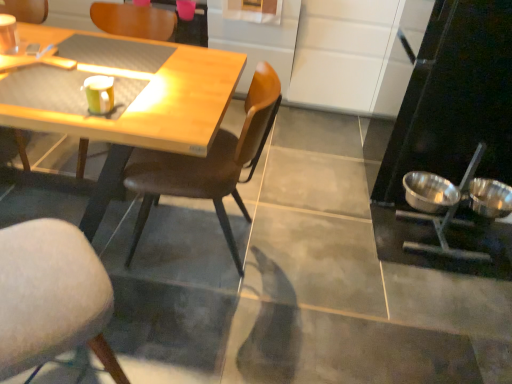
Question: From a real-world perspective, is soft gray cushioned chair at lower left, which is the third chair in left-to-right order, positioned over brown leather chair at center, which is counted as the fourth chair, starting from the left, based on gravity?

Choices:
 (A) yes
 (B) no

Answer: (B)

Question: From a real-world perspective, is soft gray cushioned chair at lower left, which is the third chair in left-to-right order, located beneath brown leather chair at center, which is counted as the fourth chair, starting from the left?

Choices:
 (A) yes
 (B) no

Answer: (A)

Question: Considering the relative sizes of soft gray cushioned chair at lower left, which is the third chair in left-to-right order, and brown leather chair at center, which is counted as the fourth chair, starting from the left, in the image provided, is soft gray cushioned chair at lower left, which is the third chair in left-to-right order, shorter than brown leather chair at center, which is counted as the fourth chair, starting from the left,?

Choices:
 (A) no
 (B) yes

Answer: (B)

Question: Is brown leather chair at center, which is counted as the fourth chair, starting from the left, located within soft gray cushioned chair at lower left, the 2th chair in the right-to-left sequence?

Choices:
 (A) yes
 (B) no

Answer: (B)

Question: Is soft gray cushioned chair at lower left, the 2th chair in the right-to-left sequence, closer to camera compared to brown leather chair at center, positioned as the 1th chair in right-to-left order?

Choices:
 (A) no
 (B) yes

Answer: (B)

Question: Based on their positions, is shiny metallic bowl at right, which is counted as the 1th bowl, starting from the right, located to the left or right of stainless steel bowls at right?

Choices:
 (A) left
 (B) right

Answer: (B)

Question: Which is correct: shiny metallic bowl at right, the second bowl positioned from the left, is inside stainless steel bowls at right, or outside of it?

Choices:
 (A) inside
 (B) outside

Answer: (B)

Question: From their relative heights in the image, would you say shiny metallic bowl at right, the second bowl positioned from the left, is taller or shorter than stainless steel bowls at right?

Choices:
 (A) tall
 (B) short

Answer: (B)

Question: From the image's perspective, is shiny metallic bowl at right, which is counted as the 1th bowl, starting from the right, located above or below stainless steel bowls at right?

Choices:
 (A) below
 (B) above

Answer: (A)

Question: From a real-world perspective, relative to soft gray cushioned chair at lower left, the 2th chair in the right-to-left sequence, is wooden chair at center, the 3th chair in the right-to-left sequence, vertically above or below?

Choices:
 (A) above
 (B) below

Answer: (A)

Question: In terms of height, does wooden chair at center, the 3th chair in the right-to-left sequence, look taller or shorter compared to soft gray cushioned chair at lower left, the 2th chair in the right-to-left sequence?

Choices:
 (A) short
 (B) tall

Answer: (B)

Question: In terms of width, does wooden chair at center, the 3th chair in the right-to-left sequence, look wider or thinner when compared to soft gray cushioned chair at lower left, the 2th chair in the right-to-left sequence?

Choices:
 (A) wide
 (B) thin

Answer: (A)

Question: Is wooden chair at center, arranged as the 2th chair when viewed from the left, situated inside soft gray cushioned chair at lower left, the 2th chair in the right-to-left sequence, or outside?

Choices:
 (A) inside
 (B) outside

Answer: (B)

Question: From a real-world perspective, is pink matte coffee cup at upper center, arranged as the first coffee cup when viewed from the top, above or below matte yellow cup at upper left, the second coffee cup positioned from the back?

Choices:
 (A) above
 (B) below

Answer: (B)

Question: Is pink matte coffee cup at upper center, the first coffee cup viewed from the back, situated inside matte yellow cup at upper left, the second coffee cup positioned from the back, or outside?

Choices:
 (A) inside
 (B) outside

Answer: (B)